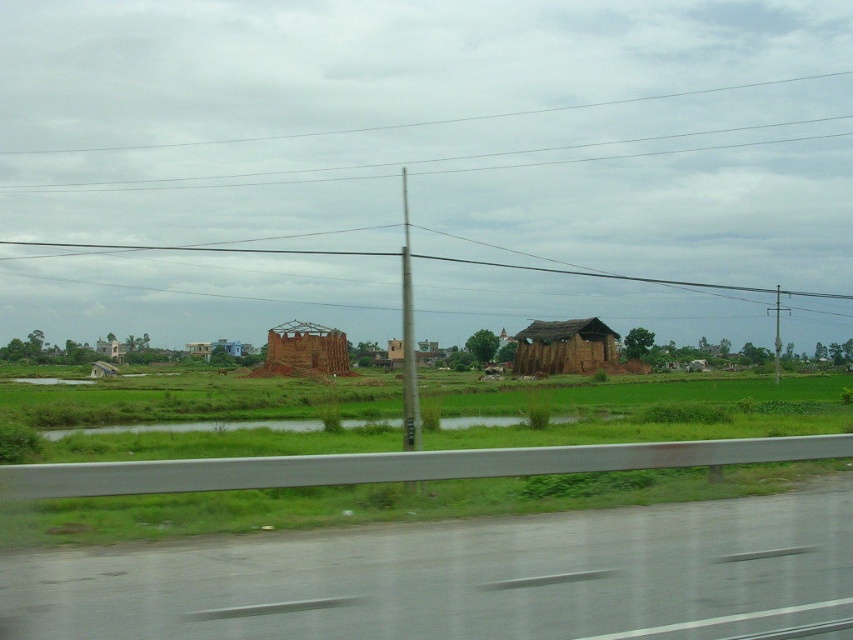
Question: Which of these objects is positioned farthest from the brown wooden hut at center?

Choices:
 (A) gray asphalt highway at lower center
 (B) brown brick hut at center

Answer: (A)

Question: Which object appears closest to the camera in this image?

Choices:
 (A) brown wooden hut at center
 (B) brown brick hut at center

Answer: (B)

Question: Is the position of gray asphalt highway at lower center more distant than that of brown brick hut at center?

Choices:
 (A) yes
 (B) no

Answer: (B)

Question: Which point is farther to the camera?

Choices:
 (A) gray asphalt highway at lower center
 (B) brown brick hut at center
 (C) brown wooden hut at center

Answer: (C)

Question: Can you confirm if brown wooden hut at center is positioned to the right of brown brick hut at center?

Choices:
 (A) no
 (B) yes

Answer: (B)

Question: Where is gray asphalt highway at lower center located in relation to brown brick hut at center in the image?

Choices:
 (A) below
 (B) above

Answer: (B)